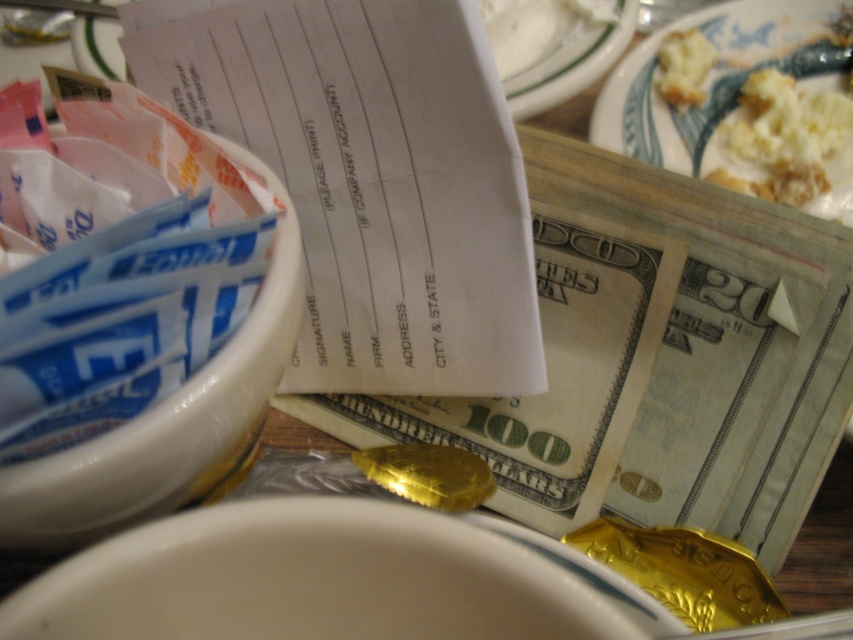
Between white paper receipt at center and white glossy bowl at lower center, which one has less height?

white glossy bowl at lower center is shorter.

Does point (471, 240) come in front of point (668, 621)?

No, (471, 240) is behind (668, 621).

This screenshot has width=853, height=640. I want to click on white paper receipt at center, so click(x=375, y=180).

Does white creamy ice cream at upper center have a lesser width compared to golden crumbly bread at upper right?

No.

Which is in front, point (521, 49) or point (669, 36)?

Point (521, 49) is more forward.

Does point (525, 32) come farther from viewer compared to point (688, 74)?

Yes, it is behind point (688, 74).

The image size is (853, 640). Find the location of `white creamy ice cream at upper center`. white creamy ice cream at upper center is located at coordinates (538, 26).

Can you confirm if white glossy bowl at lower center is positioned above white glossy bowl at upper left?

Actually, white glossy bowl at lower center is below white glossy bowl at upper left.

Is point (167, 614) positioned in front of point (74, 506)?

Yes.

Is point (282, 564) in front of point (256, 358)?

Yes, it is in front of point (256, 358).

The image size is (853, 640). Find the location of `white glossy bowl at lower center`. white glossy bowl at lower center is located at coordinates (329, 579).